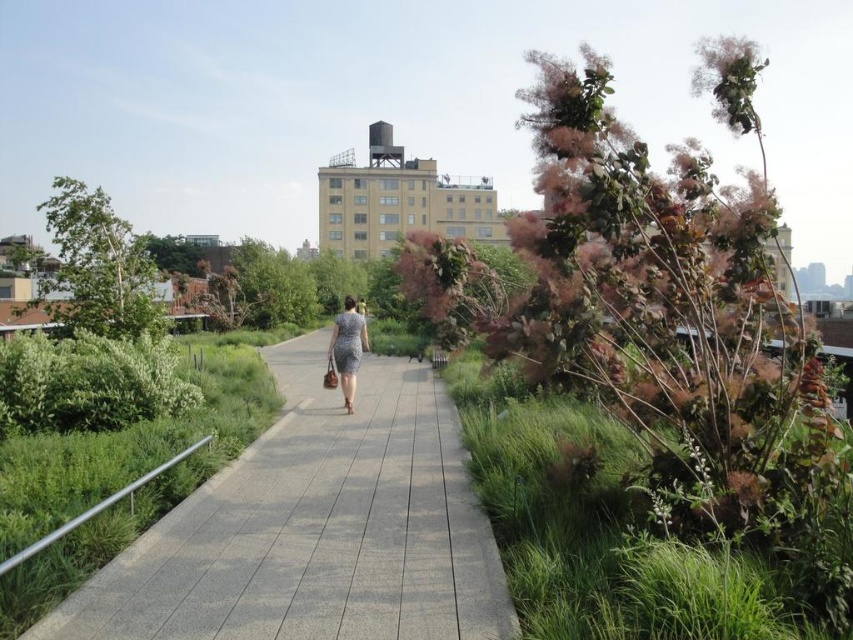
Question: Is green grass at right below patterned fabric dress at center?

Choices:
 (A) yes
 (B) no

Answer: (A)

Question: Does green grass at right have a larger size compared to patterned fabric dress at center?

Choices:
 (A) no
 (B) yes

Answer: (A)

Question: Which of the following is the closest to the observer?

Choices:
 (A) (497, 465)
 (B) (354, 353)

Answer: (A)

Question: Among these points, which one is farthest from the camera?

Choices:
 (A) (465, 417)
 (B) (351, 376)

Answer: (B)

Question: Considering the relative positions of green grass at right and patterned fabric dress at center in the image provided, where is green grass at right located with respect to patterned fabric dress at center?

Choices:
 (A) below
 (B) above

Answer: (A)

Question: Which of the following is the farthest from the observer?

Choices:
 (A) (628, 493)
 (B) (347, 403)

Answer: (B)